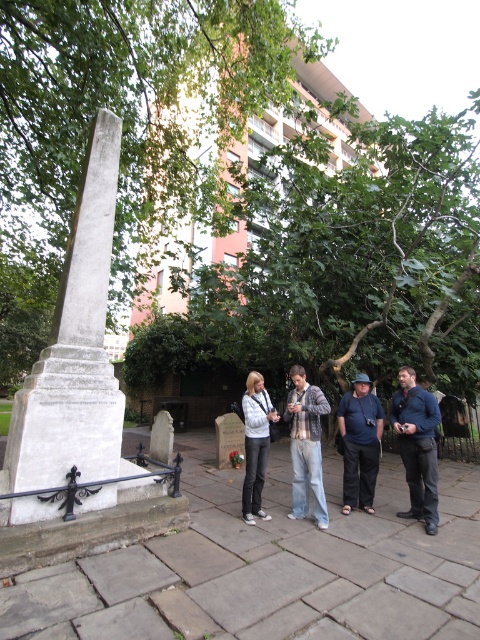
The height and width of the screenshot is (640, 480). What do you see at coordinates (80, 410) in the screenshot?
I see `white stone obelisk at left` at bounding box center [80, 410].

Which is above, white stone obelisk at left or blue cotton shirt at center?

white stone obelisk at left is higher up.

Find the location of a particular element. The image size is (480, 640). white stone obelisk at left is located at coordinates (80, 410).

Is white stone obelisk at left further to the viewer compared to white matte jacket at center?

No.

Can you confirm if white stone obelisk at left is thinner than white matte jacket at center?

No, white stone obelisk at left is not thinner than white matte jacket at center.

Where is `white stone obelisk at left`? white stone obelisk at left is located at coordinates (80, 410).

Is blue denim jacket at lower right to the right of white matte jacket at center from the viewer's perspective?

Correct, you'll find blue denim jacket at lower right to the right of white matte jacket at center.

Consider the image. Does blue denim jacket at lower right have a larger size compared to white matte jacket at center?

Indeed, blue denim jacket at lower right has a larger size compared to white matte jacket at center.

You are a GUI agent. You are given a task and a screenshot of the screen. Output one action in this format:
    pyautogui.click(x=<x>, y=<y>)
    Task: Click on the blue denim jacket at lower right
    The image size is (480, 640).
    Given the screenshot: What is the action you would take?
    pyautogui.click(x=417, y=445)